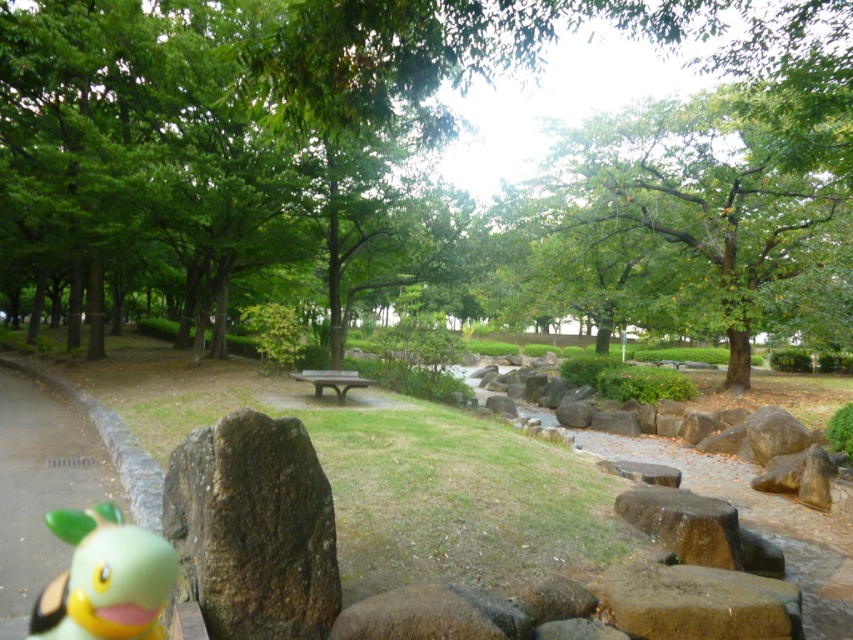
Question: Which of these objects is positioned farthest from the dark brown wooden bench at center?

Choices:
 (A) brown rough rock at lower left
 (B) green rubber duck at lower left
 (C) green leafy tree at center

Answer: (C)

Question: Does green leafy tree at center have a larger size compared to dark brown wooden bench at center?

Choices:
 (A) no
 (B) yes

Answer: (B)

Question: Which point is farther to the camera?

Choices:
 (A) brown rough rock at lower left
 (B) dark brown wooden bench at center
 (C) green leafy tree at center

Answer: (B)

Question: Is green leafy tree at center smaller than brown rough rock at lower left?

Choices:
 (A) no
 (B) yes

Answer: (A)

Question: Which object appears farthest from the camera in this image?

Choices:
 (A) green leafy tree at center
 (B) dark brown wooden bench at center
 (C) green rubber duck at lower left
 (D) brown rough rock at lower left

Answer: (B)

Question: Is green rubber duck at lower left positioned in front of dark brown wooden bench at center?

Choices:
 (A) yes
 (B) no

Answer: (A)